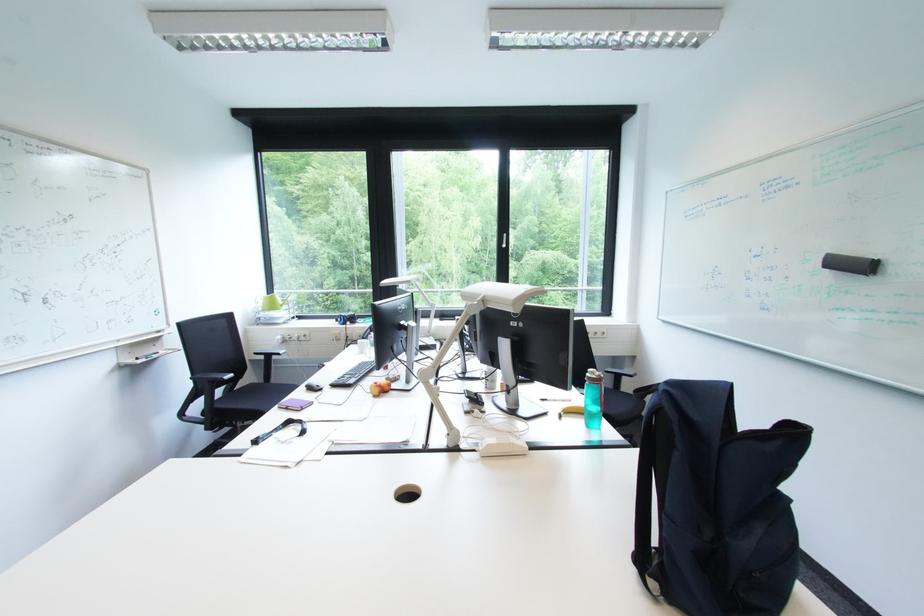
Image resolution: width=924 pixels, height=616 pixels. What do you see at coordinates (508, 240) in the screenshot? I see `a white window handle` at bounding box center [508, 240].